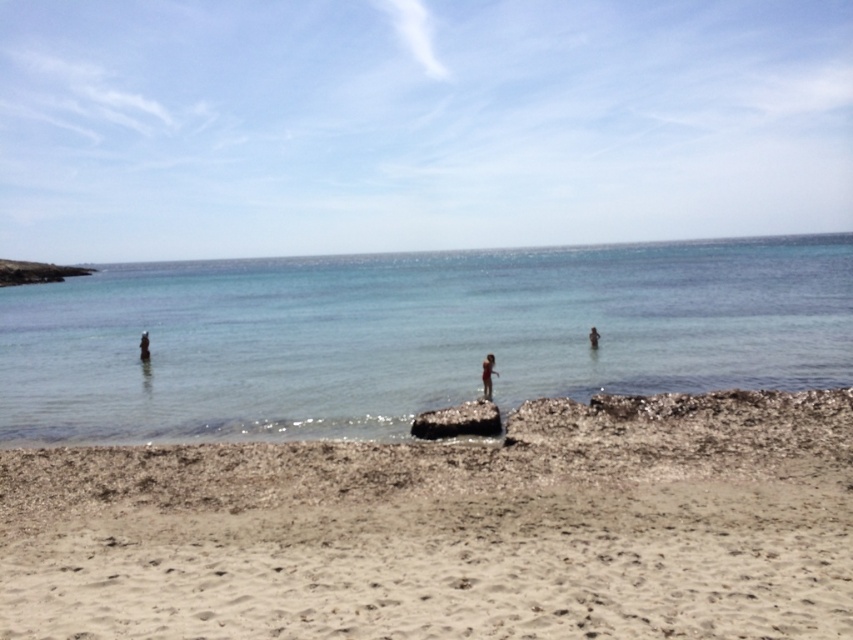
You are standing on the light beige sand at lower center and want to reach the pink fabric person at center. Which direction should you move to get closer to them?

Since the light beige sand at lower center is in front of the pink fabric person at center, you should move backward to reach them.

You are a photographer on the beach and want to capture both the black shiny rock at center and the skinny bikini swimmer at center in a single shot. Based on their sizes, which object would appear smaller in the photo?

The black shiny rock at center would appear smaller in the photo since it has a lesser height compared to the skinny bikini swimmer at center.

You are standing on the beach and see the light beige sand at lower center and the pink fabric person at center. Which object is positioned to the left of the other?

The light beige sand at lower center is to the left of the pink fabric person at center.